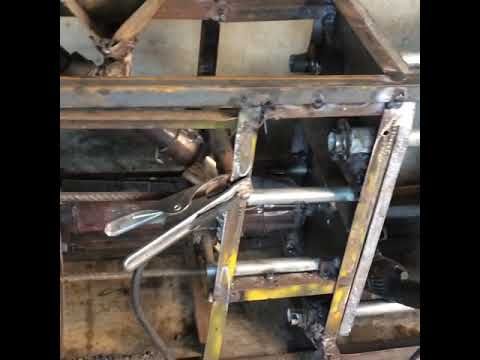
The height and width of the screenshot is (360, 480). I want to click on handles, so click(x=127, y=222), click(x=158, y=246).